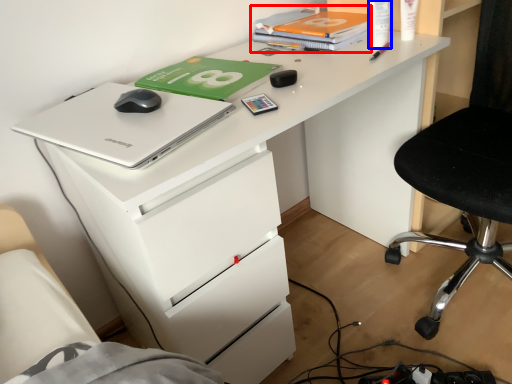
Question: Which of the following is the farthest to the observer, book (highlighted by a red box) or stationery (highlighted by a blue box)?

Choices:
 (A) book
 (B) stationery

Answer: (A)